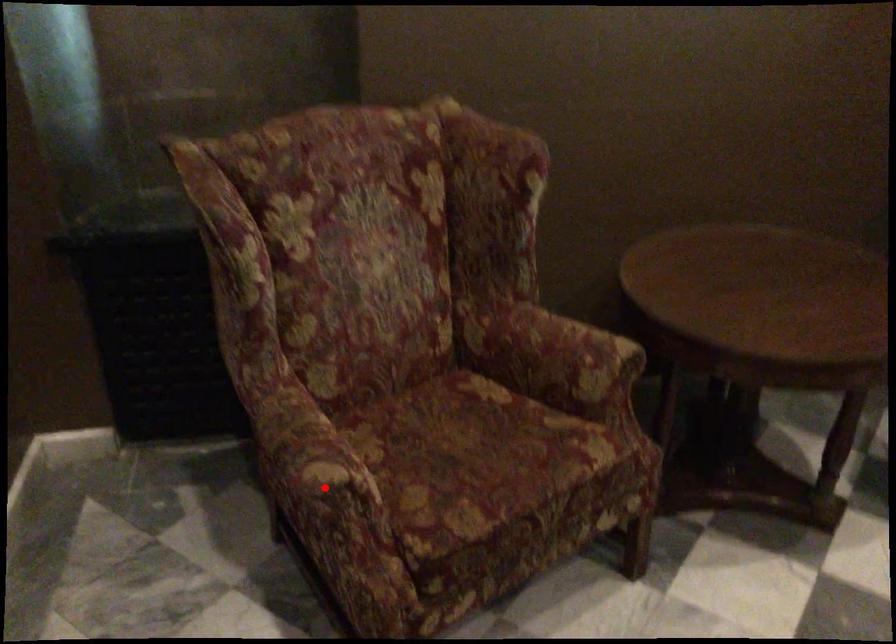
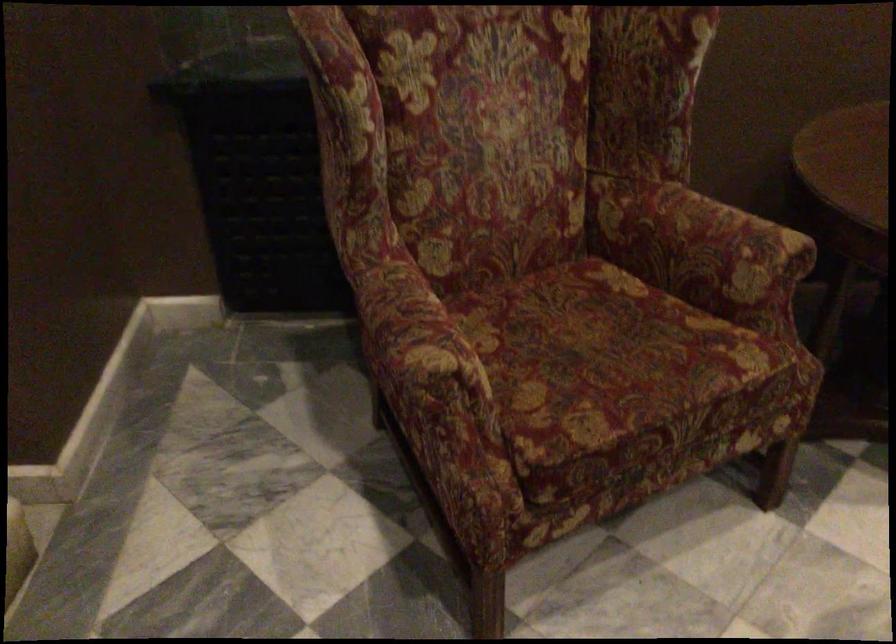
Question: I am providing you with two images of the same scene from different viewpoints. Image1 has a red point marked. In image2, the corresponding 3D location appears at what relative position? Reply with the corresponding letter.

Choices:
 (A) Closer
 (B) Farther

Answer: (A)